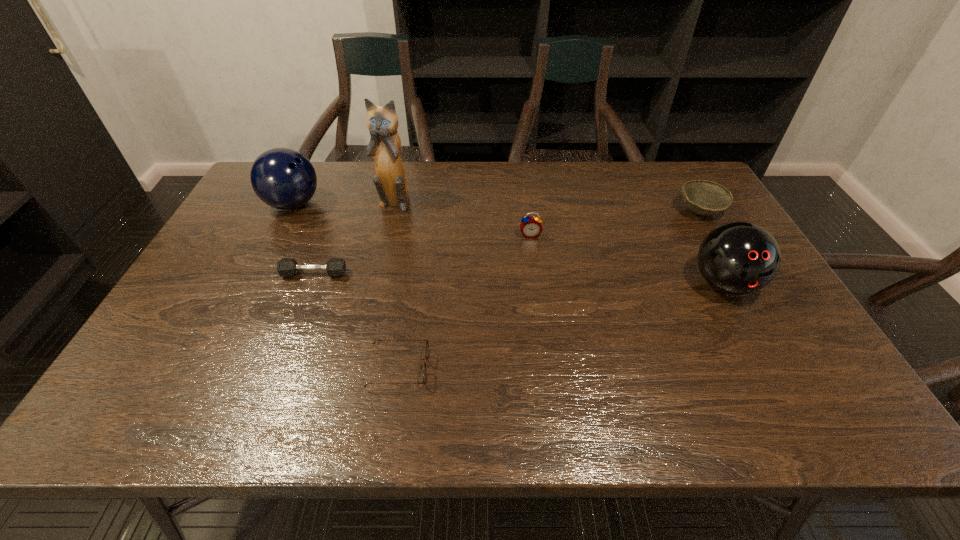
Locate an element on the screen. The width and height of the screenshot is (960, 540). cat is located at coordinates pyautogui.click(x=390, y=181).

Image resolution: width=960 pixels, height=540 pixels. Find the location of `the farther bowling ball`. the farther bowling ball is located at coordinates (283, 178).

The height and width of the screenshot is (540, 960). Identify the location of the nearer bowling ball. (738, 258).

The image size is (960, 540). Identify the location of the third object from right to left. (531, 227).

At what (x,y) coordinates should I click in order to perform the action: click on the fourth tallest object. Please return your answer as a coordinate pair (x, y). The image size is (960, 540). Looking at the image, I should click on (531, 227).

Where is `bowl`? The height and width of the screenshot is (540, 960). bowl is located at coordinates (703, 197).

Find the location of a particular element. This screenshot has height=540, width=960. dumbbell is located at coordinates (287, 266).

This screenshot has width=960, height=540. In order to click on the nearest object in this screenshot , I will do `click(427, 345)`.

Find the location of `sunglasses`. sunglasses is located at coordinates (427, 345).

I want to click on vacant space located 0.290m on the face of the tallest object, so click(x=375, y=278).